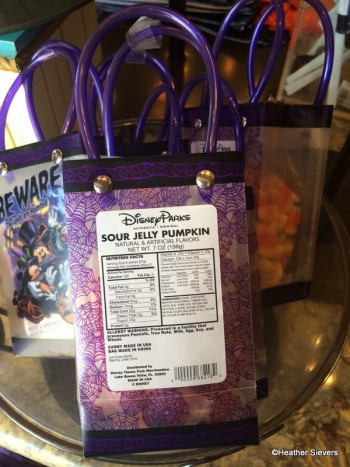
The height and width of the screenshot is (467, 350). In order to click on countertop in this screenshot , I will do `click(318, 422)`.